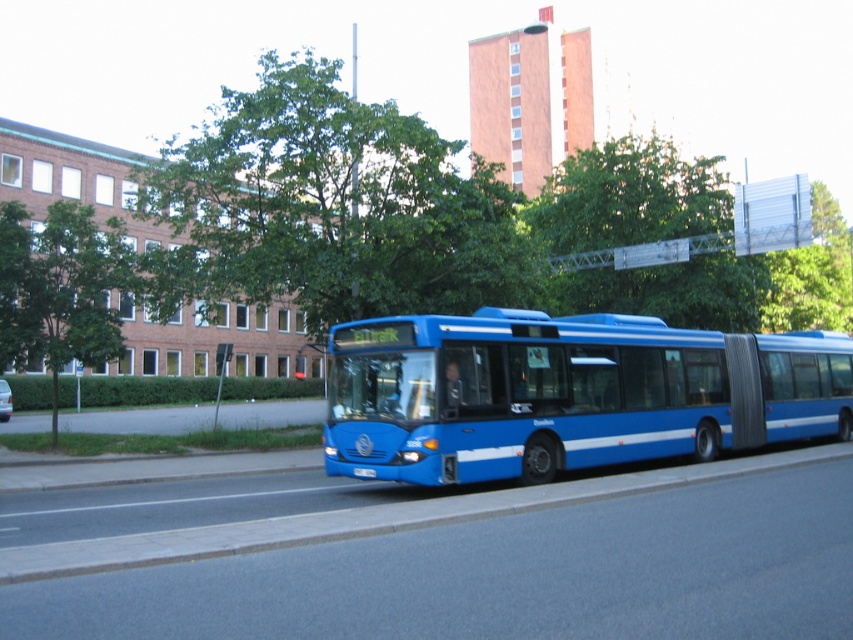
You are a pedestrian standing at a crosswalk near the blue articulated bus. You notice two green leafy trees in the scene. Which tree, the green leafy tree at left or the green leafy tree at upper right, is taller?

The green leafy tree at upper right is taller than the green leafy tree at left.

You are a drone operator planning to fly a drone between the green leafy tree at upper center and the green leafy tree at upper right. The drone has a wingspan of 1.5 meters. Can the drone safely pass through the space between them?

The green leafy tree at upper center and green leafy tree at upper right are 8.04 meters apart from each other. Since the drone has a wingspan of 1.5 meters, there is sufficient space for it to pass safely between them.

You are standing at the point marked as point (102, 307) in the scene. The bus is moving towards you. Is the bus within a safe distance of 20 meters from your current position?

The distance between point (102, 307) and the camera is 19.91 meters, which is within the safe distance of 20 meters. Therefore, the bus is within a safe distance of 20 meters from your current position.